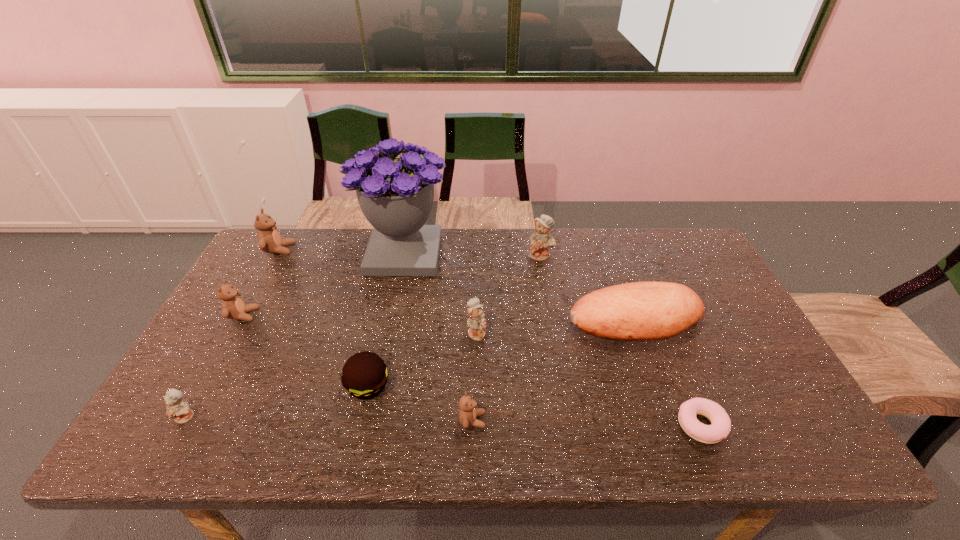
Where is `bouquet`? Image resolution: width=960 pixels, height=540 pixels. bouquet is located at coordinates coord(396,195).

Where is `the tallest object`? the tallest object is located at coordinates (396, 195).

Image resolution: width=960 pixels, height=540 pixels. What are the coordinates of `the biggest brown teddy bear` in the screenshot? It's located at (269, 240).

Find the location of a particular element. The image size is (960, 540). the rightmost teddy bear is located at coordinates (541, 240).

Where is `the rightmost blue teddy bear`? This screenshot has width=960, height=540. the rightmost blue teddy bear is located at coordinates (541, 240).

This screenshot has height=540, width=960. Identify the location of the second blue teddy bear from left to right. (476, 323).

The width and height of the screenshot is (960, 540). Identify the location of the second farthest blue teddy bear. (476, 323).

This screenshot has height=540, width=960. Identify the location of the second farthest brown teddy bear. (233, 307).

What are the coordinates of `light bread` in the screenshot? It's located at (638, 311).

Locate an element on the screen. patty is located at coordinates (364, 375).